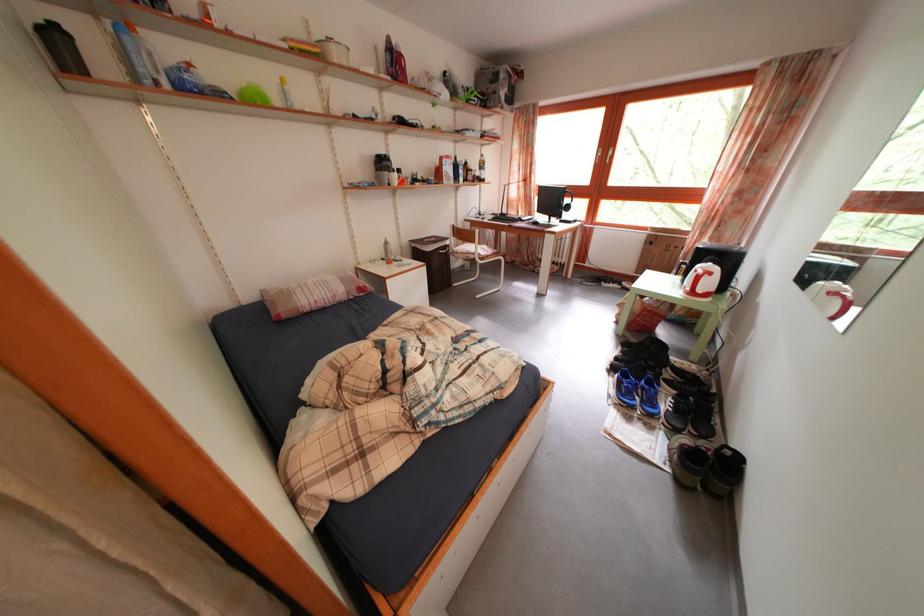
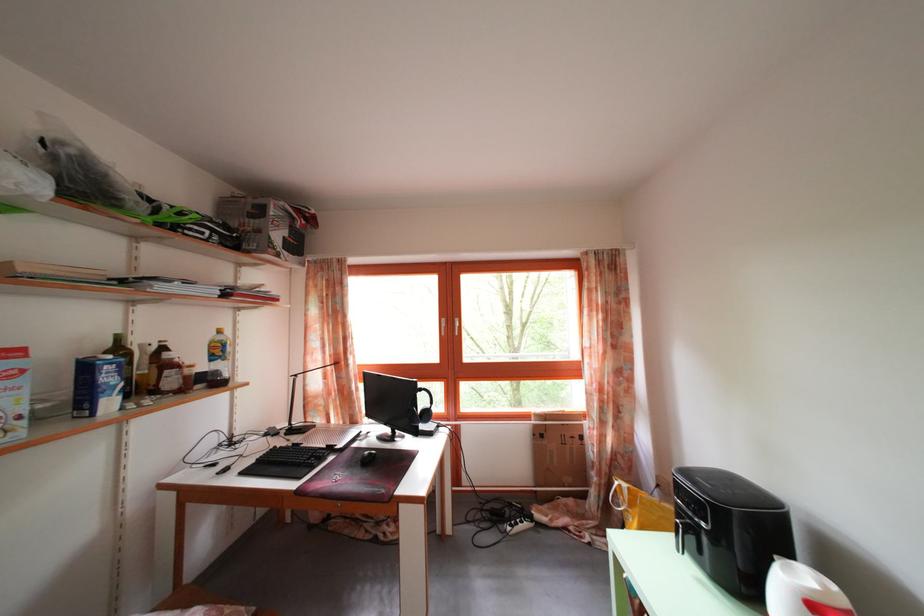
The point at (x=657, y=243) is marked in the first image. Where is the corresponding point in the second image?

(542, 432)